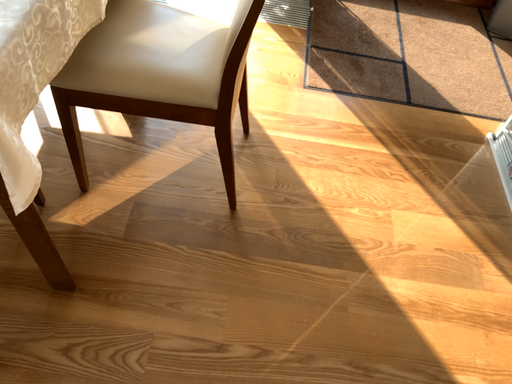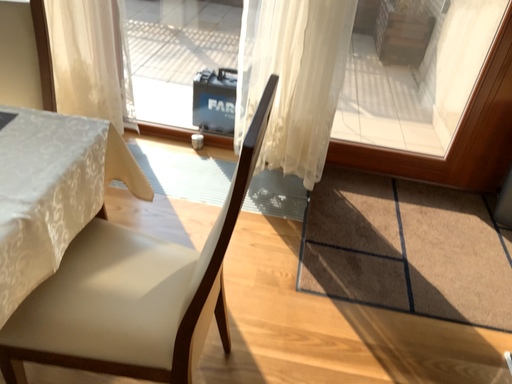
Question: How did the camera likely rotate when shooting the video?

Choices:
 (A) rotated upward
 (B) rotated downward

Answer: (A)